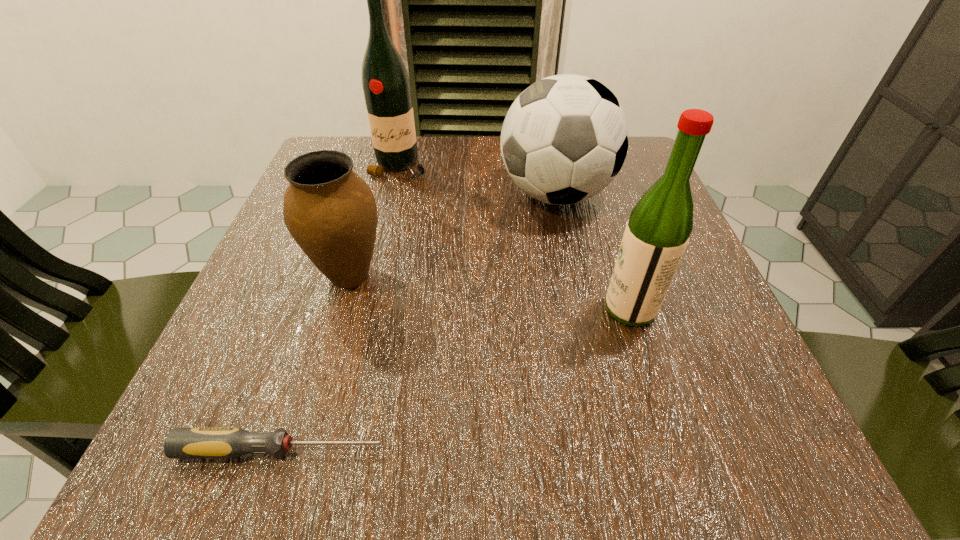
Image resolution: width=960 pixels, height=540 pixels. I want to click on vacant point located on the main logo of the soccer ball, so click(x=439, y=194).

Find the location of a particular element. This screenshot has height=540, width=960. vacant position located 0.170m on the main logo of the soccer ball is located at coordinates (415, 194).

The image size is (960, 540). What are the coordinates of `blank space located on the main logo of the soccer ball` in the screenshot? It's located at (374, 194).

The image size is (960, 540). What are the coordinates of `blank area located 0.100m on the back of the urn` in the screenshot? It's located at (368, 215).

Locate an element on the screen. free space located insert the nearest object into a screw head is located at coordinates (493, 449).

The height and width of the screenshot is (540, 960). I want to click on wine bottle that is at the far edge, so click(x=386, y=86).

Where is `soccer ball situated at the far edge`? soccer ball situated at the far edge is located at coordinates (564, 139).

Identify the location of object that is at the near edge. The height and width of the screenshot is (540, 960). (229, 442).

Find the location of a particular element. This screenshot has width=960, height=540. wine bottle located in the left edge section of the desktop is located at coordinates [386, 86].

Identify the location of urn present at the left edge. The width and height of the screenshot is (960, 540). (330, 211).